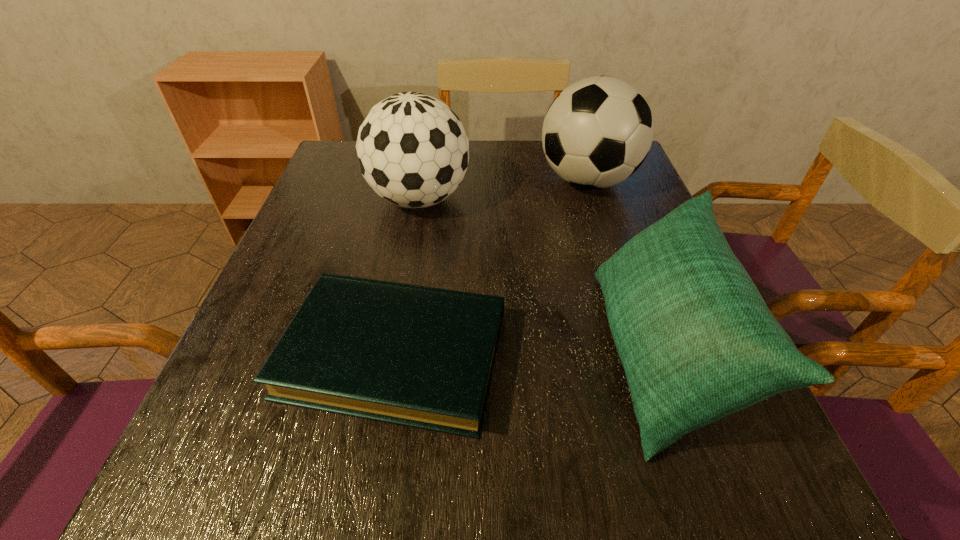
Locate an element on the screen. The image size is (960, 540). object at the near edge is located at coordinates (697, 342).

The image size is (960, 540). Identify the location of soccer ball located at the left edge. [413, 151].

Identify the location of book positioned at the left edge. (418, 356).

I want to click on soccer ball located in the right edge section of the desktop, so click(x=597, y=132).

The width and height of the screenshot is (960, 540). What are the coordinates of `cushion that is at the right edge` in the screenshot? It's located at (697, 342).

This screenshot has width=960, height=540. In order to click on object positioned at the far left corner in this screenshot , I will do pos(413,151).

This screenshot has width=960, height=540. Find the location of `object that is at the far right corner`. object that is at the far right corner is located at coordinates (597, 132).

At what (x,y) coordinates should I click in order to perform the action: click on object that is at the near right corner. Please return your answer as a coordinate pair (x, y). The width and height of the screenshot is (960, 540). Looking at the image, I should click on (697, 342).

Find the location of a particular element. vacant space at the near edge is located at coordinates (516, 501).

Image resolution: width=960 pixels, height=540 pixels. What are the coordinates of `vacant space at the left edge of the desktop` in the screenshot? It's located at (328, 254).